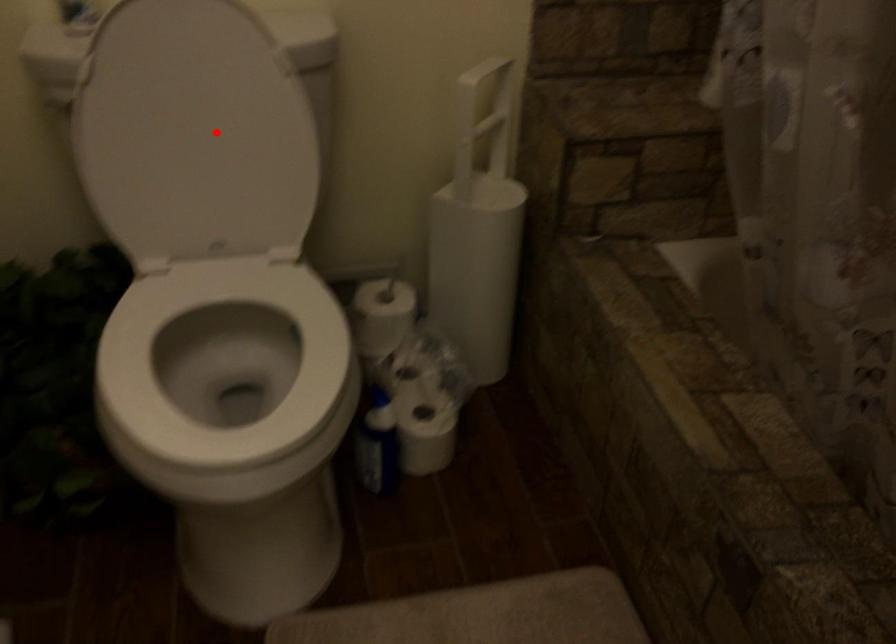
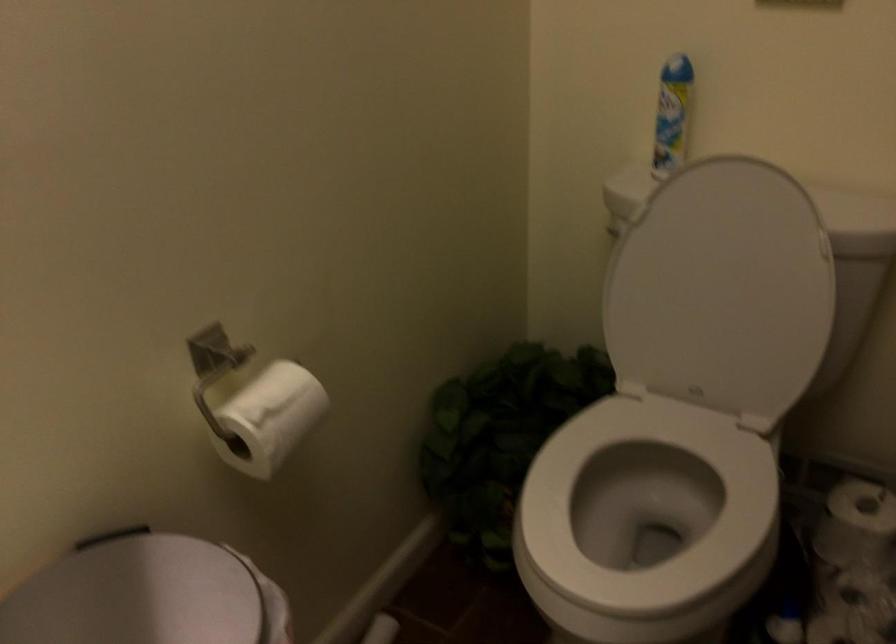
Locate, in the second image, the point that corresponds to the highlighted location in the first image.

(721, 289)